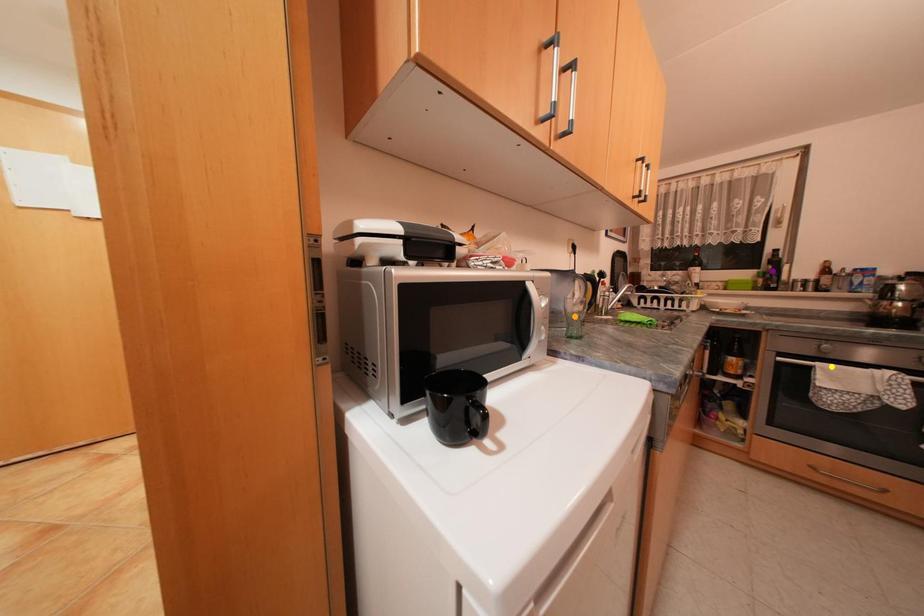
Order these from nearest to farthest:
purple point | orange point | yellow point

1. orange point
2. yellow point
3. purple point